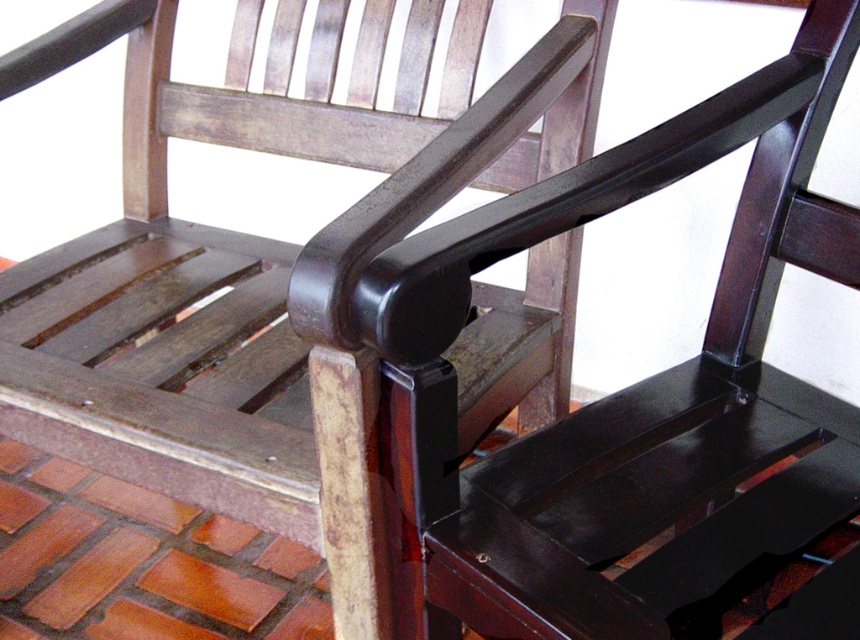
Question: Which of the following is the farthest from the observer?

Choices:
 (A) glossy dark wood armrest at center
 (B) glossy black armrest at center

Answer: (B)

Question: Which point is closer to the camera taking this photo?

Choices:
 (A) (372, 534)
 (B) (774, 541)

Answer: (B)

Question: From the image, what is the correct spatial relationship of glossy dark wood armrest at center in relation to glossy black armrest at center?

Choices:
 (A) right
 (B) left

Answer: (A)

Question: Which object is farther from the camera taking this photo?

Choices:
 (A) glossy dark wood armrest at center
 (B) glossy black armrest at center

Answer: (B)

Question: Is glossy dark wood armrest at center wider than glossy black armrest at center?

Choices:
 (A) no
 (B) yes

Answer: (A)

Question: Considering the relative positions of glossy dark wood armrest at center and glossy black armrest at center in the image provided, where is glossy dark wood armrest at center located with respect to glossy black armrest at center?

Choices:
 (A) right
 (B) left

Answer: (A)